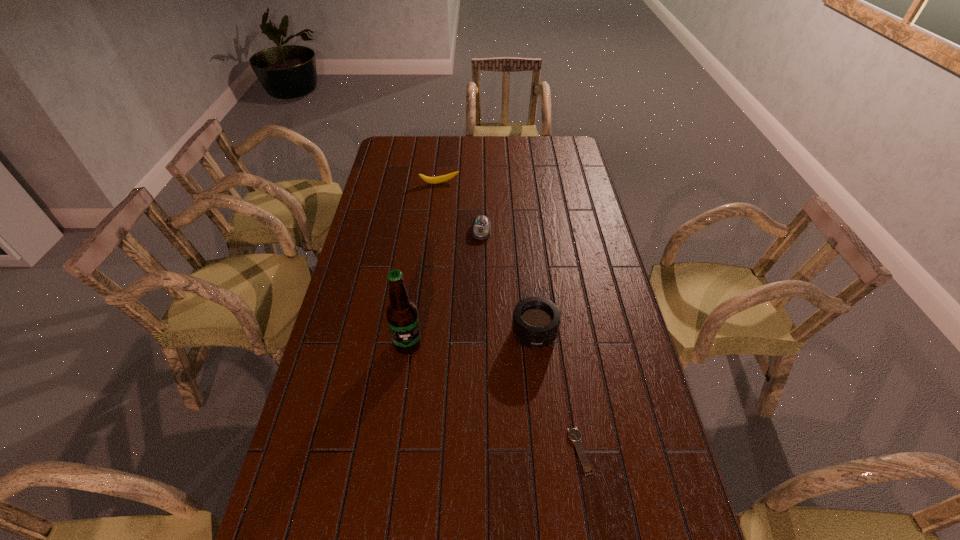
This screenshot has height=540, width=960. Find the location of `the tallest object`. the tallest object is located at coordinates (402, 316).

You are a GUI agent. You are given a task and a screenshot of the screen. Output one action in this format:
    pyautogui.click(x=<x>, y=<y>)
    Task: Click on the shortest object
    This screenshot has width=960, height=540.
    Given the screenshot: What is the action you would take?
    pyautogui.click(x=574, y=434)

Where is `the nearest object`? the nearest object is located at coordinates (574, 434).

The height and width of the screenshot is (540, 960). I want to click on the third tallest object, so click(439, 179).

Locate an element on the screen. The width and height of the screenshot is (960, 540). banana is located at coordinates (439, 179).

Where is `telephoto lens`? telephoto lens is located at coordinates (536, 320).

The height and width of the screenshot is (540, 960). Identify the location of the second shortest object. point(481,229).

Identify the location of the third object from right to left. (481, 229).

The width and height of the screenshot is (960, 540). In order to click on free region located on the label of the beer bottle in this screenshot , I will do `click(388, 492)`.

Locate an element on the screen. free location located 0.370m on the back of the watch is located at coordinates (559, 316).